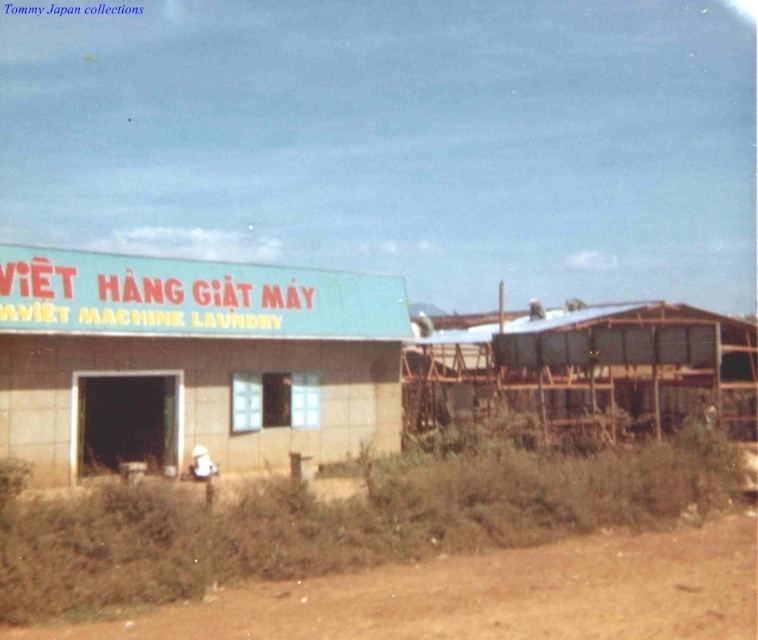
You are standing at the entrance of the Viet Machine Laundry building. There is a point marked at coordinates (486, 596). What does this point represent?

The point at coordinates (486, 596) represents the brown dirt track at lower center.